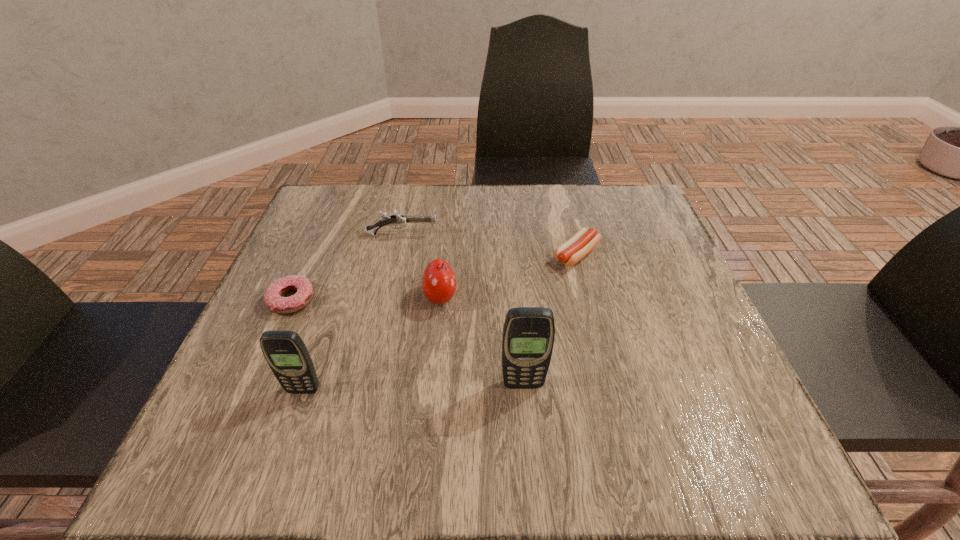
The cellular telephones are evenly distributed in the image. To maintain this, where would you place another cellular telephone on the right? Please point to a free space. Please provide its 2D coordinates. Your answer should be formatted as a tuple, i.e. [(x, y)], where the tuple contains the x and y coordinates of a point satisfying the conditions above.

[(737, 379)]